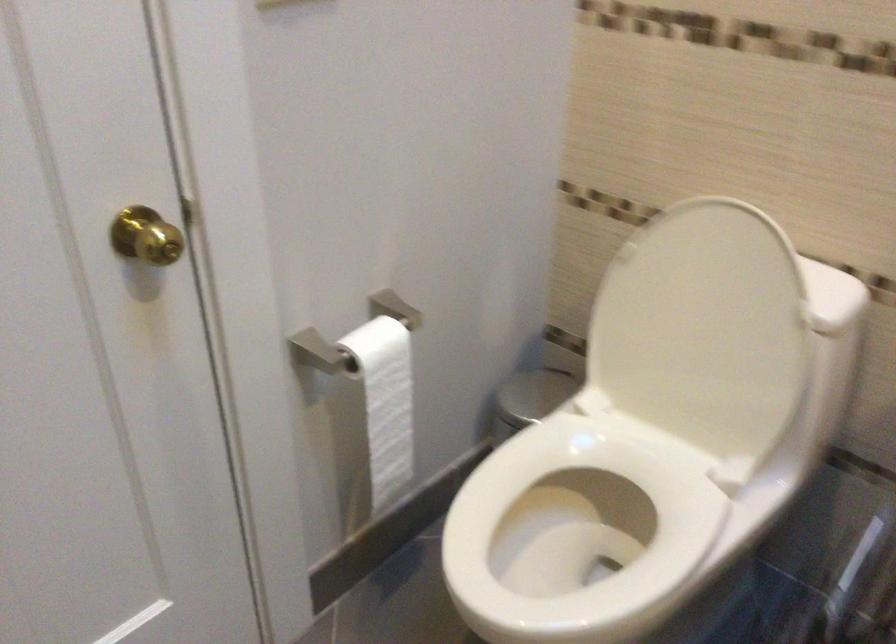
I want to click on toilet seat, so click(581, 531).